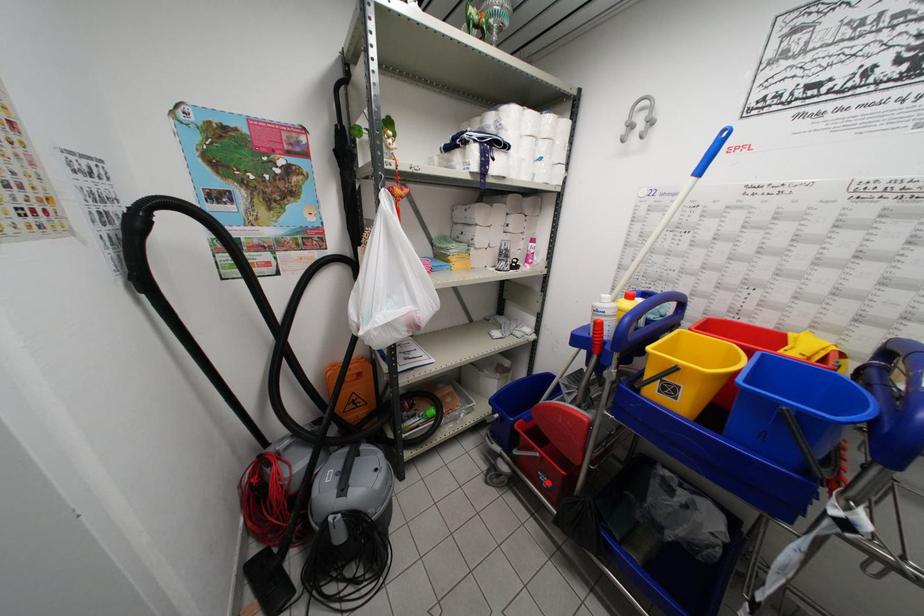
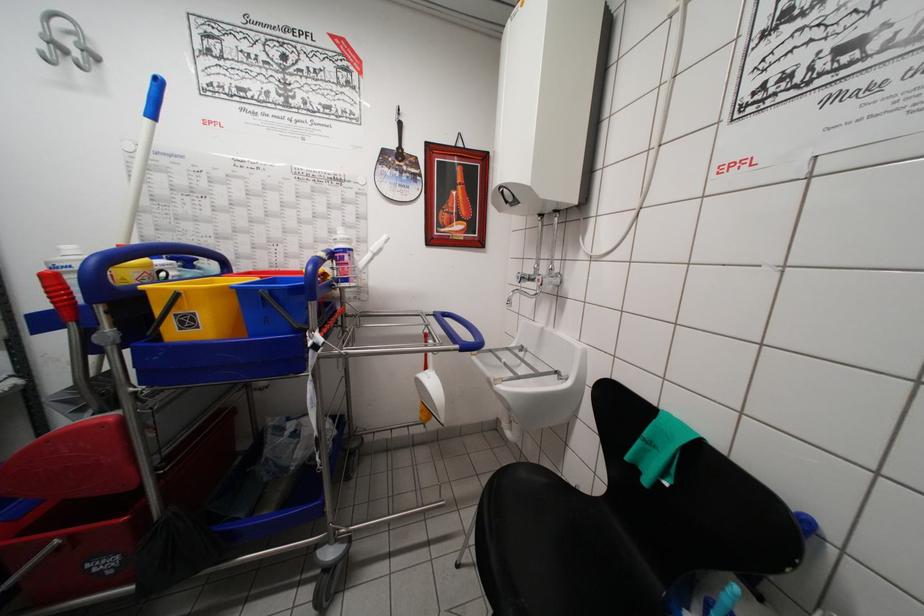
Question: I am providing you with two images of the same scene from different viewpoints. Given a red point in image1, look at the same physical point in image2. Is it:

Choices:
 (A) Closer to the viewpoint
 (B) Farther from the viewpoint

Answer: (A)